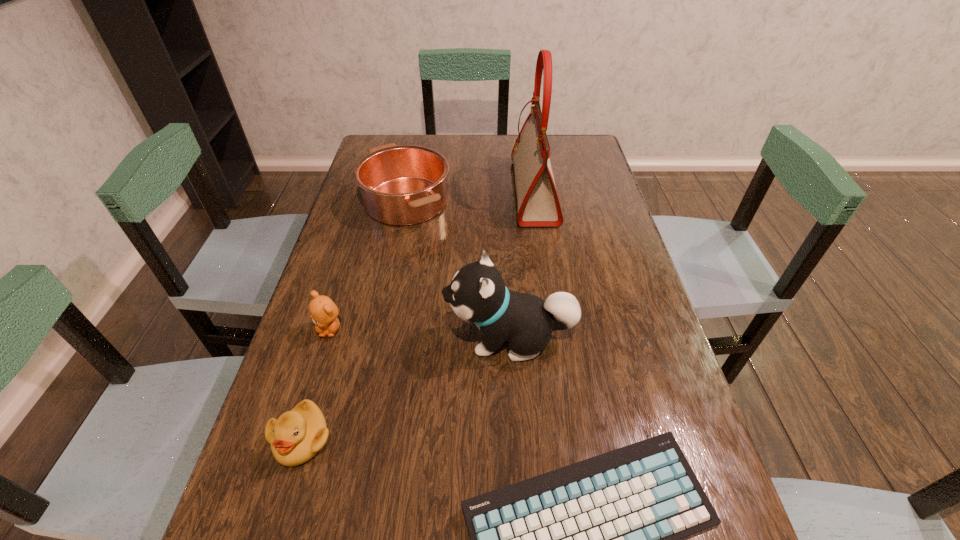
Identify the location of the tallest object. (538, 204).

At what (x,y) coordinates should I click in order to perform the action: click on the fifth shortest object. Please return your answer as a coordinate pair (x, y). Looking at the image, I should click on (477, 294).

Find the location of a particular element. This screenshot has height=540, width=960. saucepan is located at coordinates (401, 185).

The width and height of the screenshot is (960, 540). In order to click on teddy bear in this screenshot , I will do `click(323, 311)`.

At what (x,y) coordinates should I click in order to perform the action: click on duckling. Please return your answer as a coordinate pair (x, y). This screenshot has width=960, height=540. Looking at the image, I should click on (298, 435).

You are a GUI agent. You are given a task and a screenshot of the screen. Output one action in this format:
    pyautogui.click(x=<x>, y=<y>)
    Task: Click on the free space located on the left of the tallest object
    This screenshot has width=960, height=540.
    Given the screenshot: What is the action you would take?
    pyautogui.click(x=476, y=192)

This screenshot has width=960, height=540. Find the location of `vacant space located at the face of the puppy`. vacant space located at the face of the puppy is located at coordinates (313, 338).

The height and width of the screenshot is (540, 960). Find the location of `vacant space located at the face of the puppy`. vacant space located at the face of the puppy is located at coordinates (344, 338).

You are a GUI agent. You are given a task and a screenshot of the screen. Output one action in this format:
    pyautogui.click(x=<x>, y=<y>)
    Task: Click on the free region located at the face of the puppy
    
    Given the screenshot: What is the action you would take?
    pyautogui.click(x=401, y=338)

The image size is (960, 540). Find the location of `vacant space located 0.050m on the right of the saucepan`. vacant space located 0.050m on the right of the saucepan is located at coordinates (467, 201).